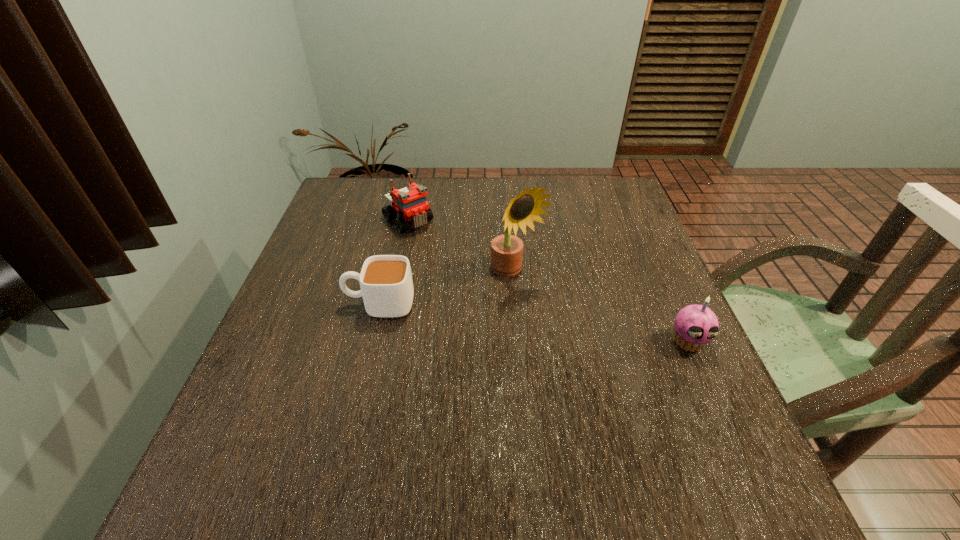
Locate an element on the screen. free space on the desktop that is between the cup and the rightmost object and is positioned on the front-facing side of the farthest object is located at coordinates (520, 321).

The height and width of the screenshot is (540, 960). Identify the location of vacant space on the desktop that is between the shortest object and the cupcake and is positioned on the face of the second object from right to left. (570, 327).